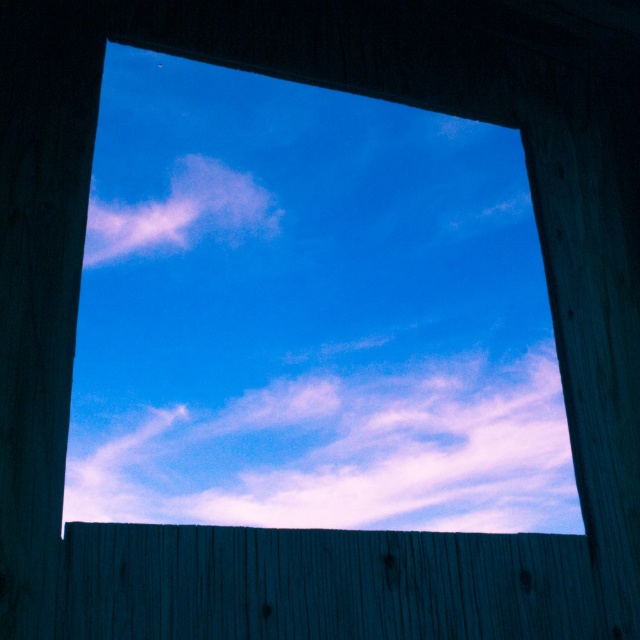
Is transparent glass window at center taller than pink cotton cloud at upper center?

Yes.

This screenshot has width=640, height=640. Find the location of `transparent glass window at center`. transparent glass window at center is located at coordinates (308, 314).

The height and width of the screenshot is (640, 640). Identify the location of transparent glass window at center. (308, 314).

Locate an element on the screen. The width and height of the screenshot is (640, 640). transparent glass window at center is located at coordinates (308, 314).

Does white fluffy cloud at center have a greater width compared to smooth wooden fence at bottom?

No, white fluffy cloud at center is not wider than smooth wooden fence at bottom.

Who is shorter, white fluffy cloud at center or smooth wooden fence at bottom?

Standing shorter between the two is smooth wooden fence at bottom.

Measure the distance between white fluffy cloud at center and camera.

white fluffy cloud at center is 5.56 feet away from camera.

Locate an element on the screen. Image resolution: width=640 pixels, height=640 pixels. white fluffy cloud at center is located at coordinates (342, 452).

Between point (420, 372) and point (529, 528), which one is positioned in front?

Point (529, 528) is more forward.

Is transparent glass window at center to the right of white fluffy cloud at center from the viewer's perspective?

Incorrect, transparent glass window at center is not on the right side of white fluffy cloud at center.

I want to click on transparent glass window at center, so click(308, 314).